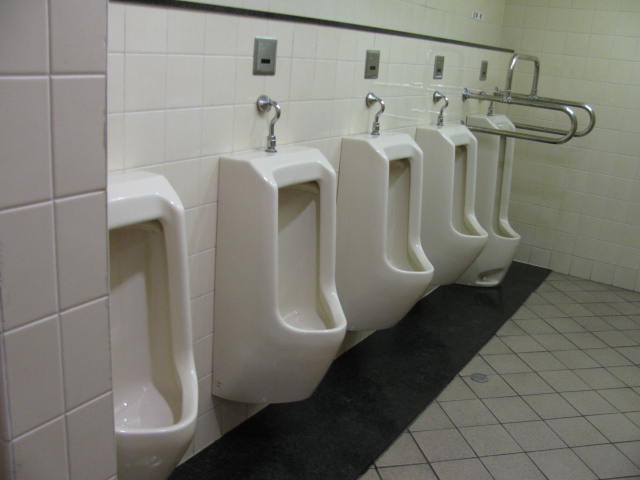
The height and width of the screenshot is (480, 640). What are the coordinates of `urinals` in the screenshot? It's located at (495, 164), (460, 175), (380, 207), (310, 249), (160, 302).